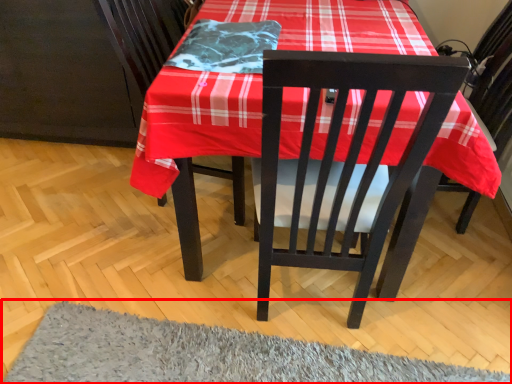
Question: From the image's perspective, considering the relative positions of mat (annotated by the red box) and blanket in the image provided, where is mat (annotated by the red box) located with respect to the staircase?

Choices:
 (A) below
 (B) above

Answer: (A)